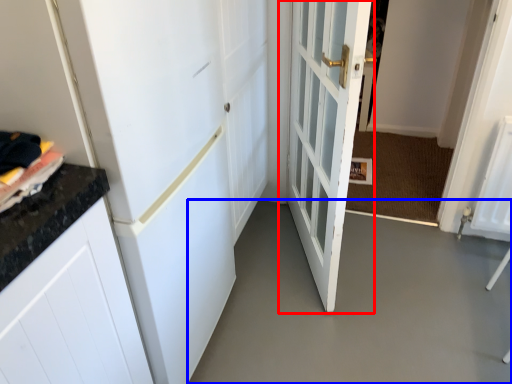
Question: Which object is further to the camera taking this photo, door (highlighted by a red box) or concrete (highlighted by a blue box)?

Choices:
 (A) door
 (B) concrete

Answer: (B)